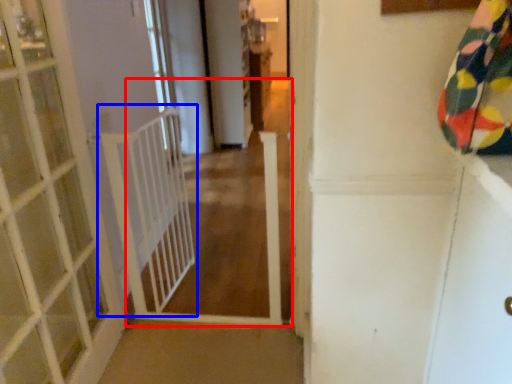
Question: Which point is further to the camera, path (highlighted by a red box) or balustrade (highlighted by a blue box)?

Choices:
 (A) path
 (B) balustrade

Answer: (B)